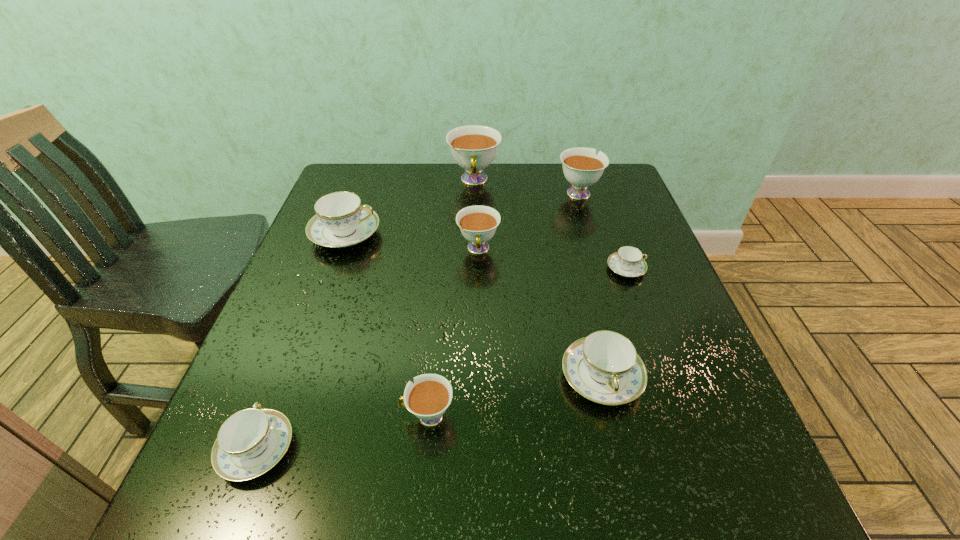
In the image, there is a desktop. Identify the location of free space at the far right corner. (610, 189).

The width and height of the screenshot is (960, 540). In the image, there is a desktop. Find the location of `free space at the near right corner`. free space at the near right corner is located at coordinates coord(711,495).

The image size is (960, 540). In order to click on free spot between the nearest blue teacup and the tallest teacup in this screenshot , I will do `click(366, 315)`.

Find the location of a particular element. This screenshot has height=540, width=960. free space between the third farthest white teacup and the smallest white teacup is located at coordinates (453, 333).

At what (x,y) coordinates should I click in order to perform the action: click on vacant space that is in between the third farthest white teacup and the biggest blue teacup. Please return your answer as a coordinate pair (x, y). Image resolution: width=960 pixels, height=540 pixels. Looking at the image, I should click on (412, 242).

Find the location of a particular element. Image resolution: width=960 pixels, height=540 pixels. unoccupied position between the tallest object and the nearest white teacup is located at coordinates (451, 299).

At what (x,y) coordinates should I click in order to perform the action: click on vacant region between the tallest teacup and the second nearest blue teacup. Please return your answer as a coordinate pair (x, y). This screenshot has height=540, width=960. Looking at the image, I should click on (538, 279).

Find the location of a particular element. vacant region between the smallest white teacup and the biggest blue teacup is located at coordinates (387, 325).

Where is `free space between the seventh shortest teacup and the tallest teacup`? This screenshot has width=960, height=540. free space between the seventh shortest teacup and the tallest teacup is located at coordinates (526, 186).

The image size is (960, 540). In order to click on vacant area that lies between the second biggest white teacup and the second nearest white teacup in this screenshot , I will do `click(528, 221)`.